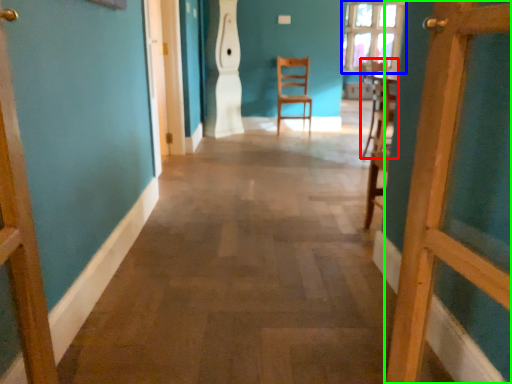
Question: Considering the real-world distances, which object is farthest from chair (highlighted by a red box)? window (highlighted by a blue box) or door (highlighted by a green box)?

Choices:
 (A) window
 (B) door

Answer: (A)